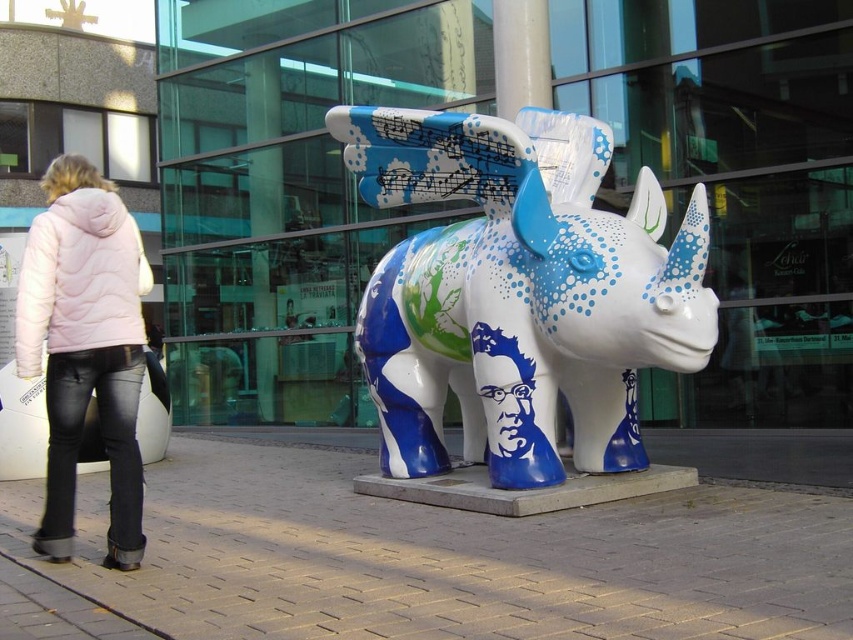
Is shiny ceramic rhino at center bigger than pink quilted jacket at lower left?

Indeed, shiny ceramic rhino at center has a larger size compared to pink quilted jacket at lower left.

Does shiny ceramic rhino at center have a lesser height compared to pink quilted jacket at lower left?

In fact, shiny ceramic rhino at center may be taller than pink quilted jacket at lower left.

Where is `shiny ceramic rhino at center`? shiny ceramic rhino at center is located at coordinates (519, 291).

At what (x,y) coordinates should I click in order to perform the action: click on shiny ceramic rhino at center. Please return your answer as a coordinate pair (x, y). The width and height of the screenshot is (853, 640). Looking at the image, I should click on (519, 291).